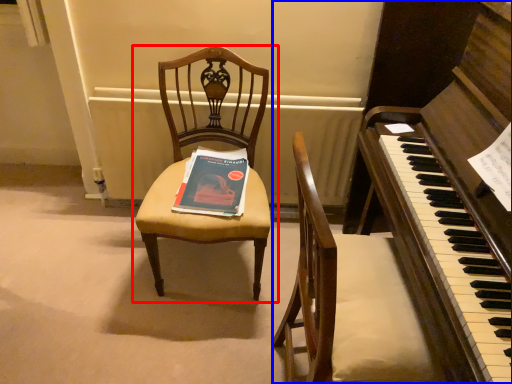
Question: Among these objects, which one is nearest to the camera, chair (highlighted by a red box) or harpsichord (highlighted by a blue box)?

Choices:
 (A) chair
 (B) harpsichord

Answer: (B)